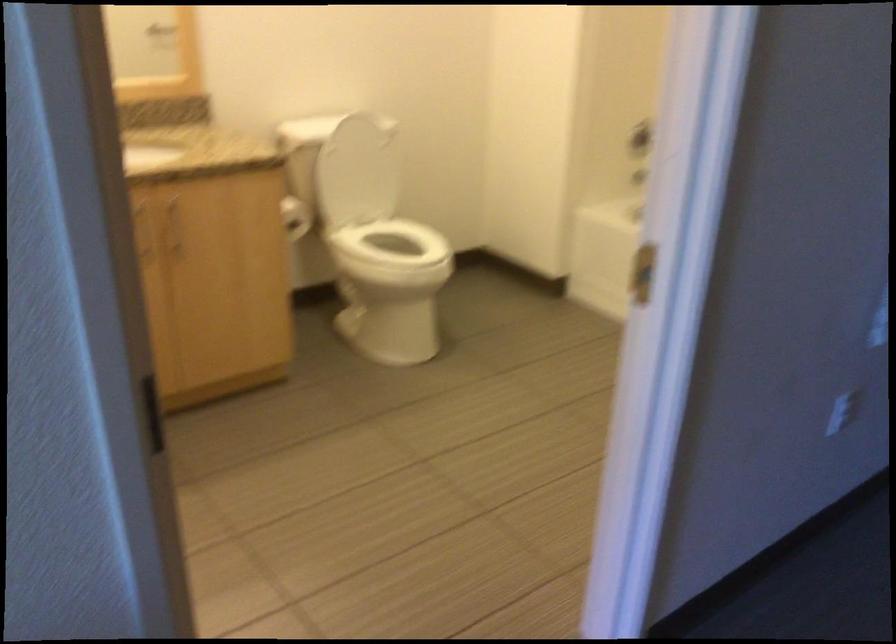
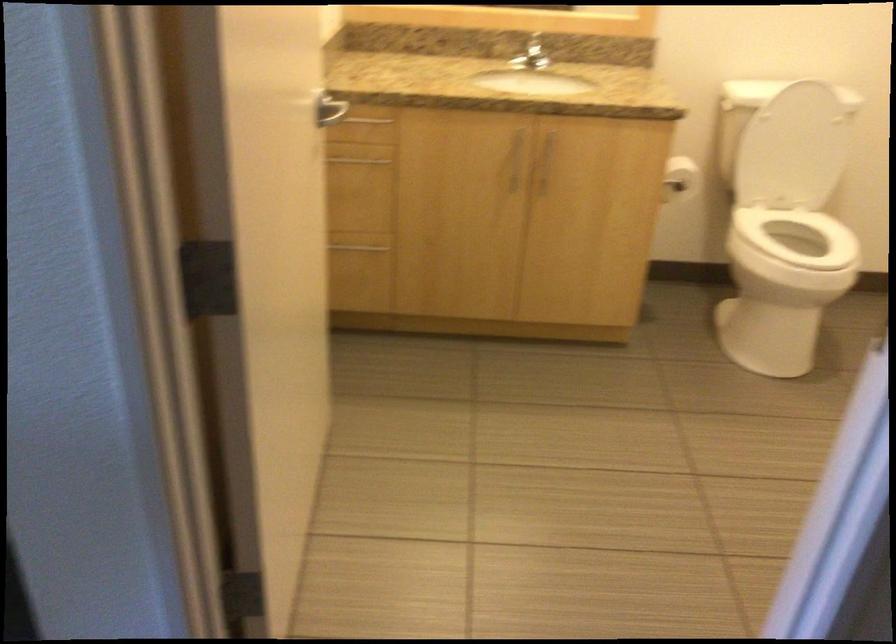
In the second image, find the point that corresponds to [297,212] in the first image.

(679, 178)